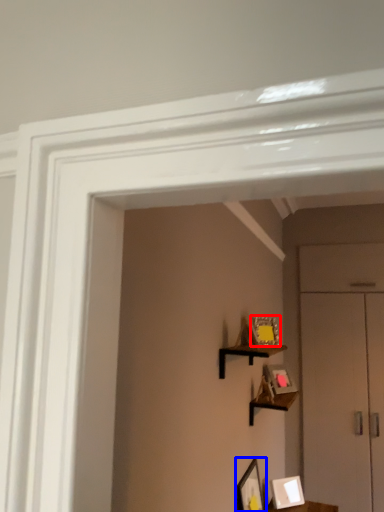
Question: Which object is further to the camera taking this photo, picture frame (highlighted by a red box) or picture frame (highlighted by a blue box)?

Choices:
 (A) picture frame
 (B) picture frame

Answer: (A)